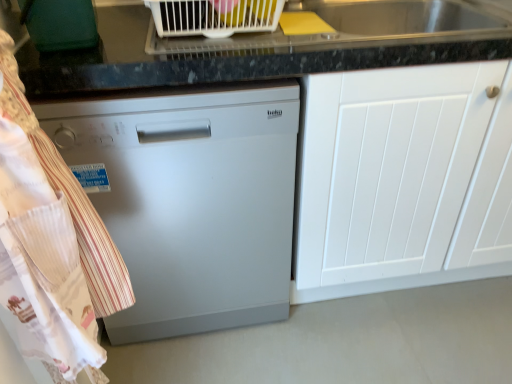
Where is `vacant space behind white striped fabric at left`? The width and height of the screenshot is (512, 384). vacant space behind white striped fabric at left is located at coordinates (150, 352).